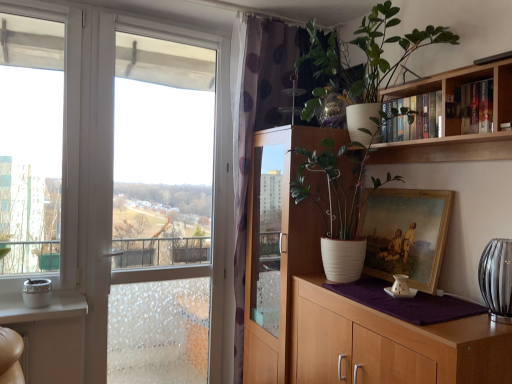
Question: Visually, is white wood cabinet at right, placed as the 2th cabinetry when sorted from front to back, positioned to the left or to the right of gold-framed painting at right?

Choices:
 (A) left
 (B) right

Answer: (A)

Question: In terms of size, does white wood cabinet at right, which is the 1th cabinetry in back-to-front order, appear bigger or smaller than gold-framed painting at right?

Choices:
 (A) big
 (B) small

Answer: (A)

Question: Which of these objects is positioned closest to the white matte pot at upper right, the first houseplant from the top?

Choices:
 (A) wooden bookshelf at upper right
 (B) gold-framed painting at right
 (C) white wood cabinet at right, placed as the 2th cabinetry when sorted from front to back
 (D) hardcover books at upper right
 (E) wooden bookshelf at upper right

Answer: (D)

Question: Estimate the real-world distances between objects in this image. Which object is closer to the wooden bookshelf at upper right?

Choices:
 (A) wooden bookshelf at upper right
 (B) clear glass window at left
 (C) wooden cabinet at right, positioned as the first cabinetry in front-to-back order
 (D) hardcover books at upper right
 (E) white wood cabinet at right, placed as the 2th cabinetry when sorted from front to back

Answer: (D)